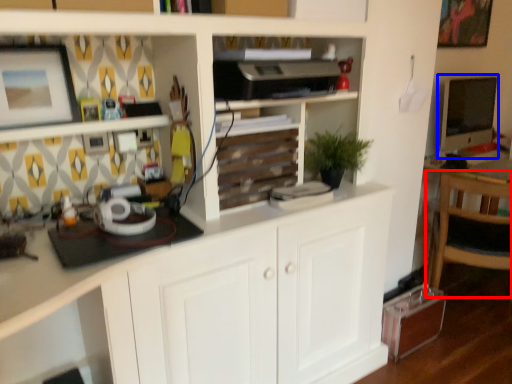
Question: Which object appears closest to the camera in this image, chair (highlighted by a red box) or computer monitor (highlighted by a blue box)?

Choices:
 (A) chair
 (B) computer monitor

Answer: (A)